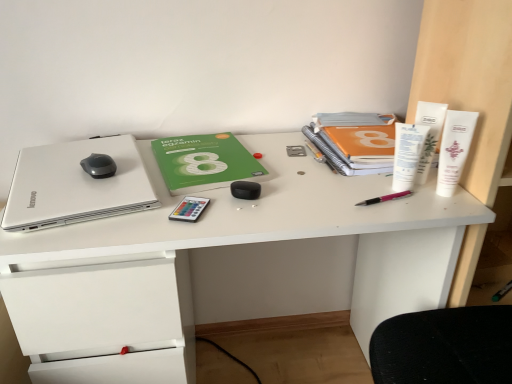
At what (x,y) coordinates should I click in order to perform the action: click on vacant space in between green matte paperback book at center, which is the second paperback book in right-to-left order, and black plastic remote control at center-left, positioned as the fifth stationery in right-to-left order. Please return your answer as a coordinate pair (x, y). The height and width of the screenshot is (384, 512). Looking at the image, I should click on (190, 193).